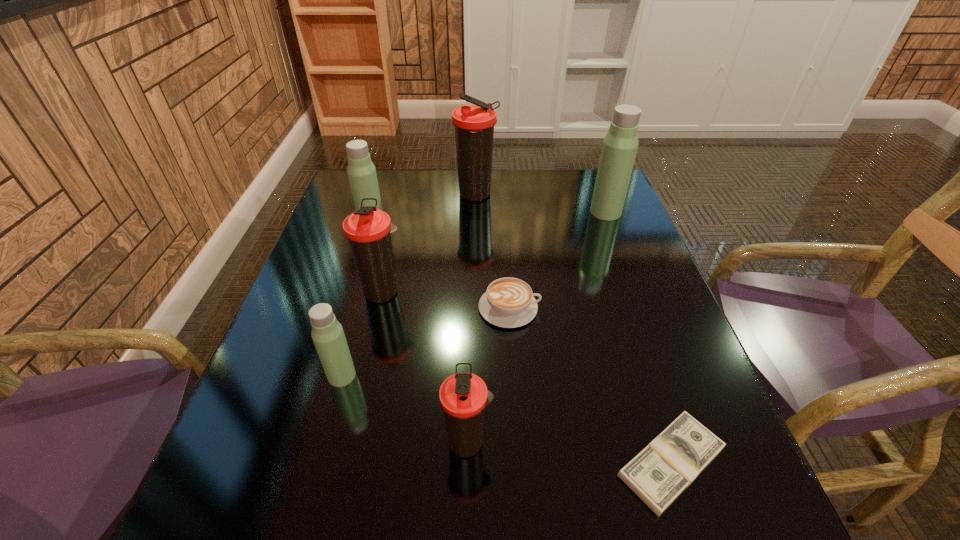
I want to click on object present at the near edge, so click(660, 472).

At what (x,y) coordinates should I click in order to perform the action: click on thermos bottle that is at the right edge. Please return your answer as a coordinate pair (x, y). This screenshot has width=960, height=540. Looking at the image, I should click on (620, 144).

Where is `dollar at the right edge`? The width and height of the screenshot is (960, 540). dollar at the right edge is located at coordinates (660, 472).

Where is `object present at the far right corner`? This screenshot has height=540, width=960. object present at the far right corner is located at coordinates (620, 144).

I want to click on object positioned at the near right corner, so click(x=660, y=472).

Where is `blank space at the far edge`? The width and height of the screenshot is (960, 540). blank space at the far edge is located at coordinates (513, 171).

Image resolution: width=960 pixels, height=540 pixels. I want to click on blank area at the near edge, so click(x=487, y=494).

Locate an element on the screen. The image size is (960, 540). free region at the left edge of the desktop is located at coordinates (243, 449).

Identify the location of free location at the right edge. (698, 400).

Identify the location of free space at the near right corner of the desktop. (757, 535).